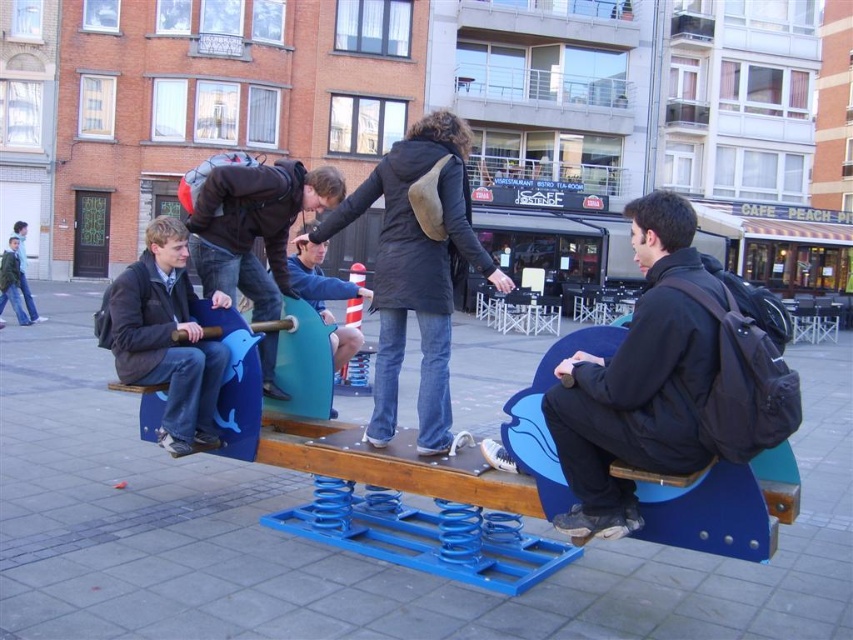
Who is taller, blue plastic bench at right or matte black jacket at left?

Standing taller between the two is matte black jacket at left.

Is blue plastic bench at right positioned before matte black jacket at left?

Yes, blue plastic bench at right is closer to the viewer.

Is point (695, 531) positioned before point (97, 314)?

Yes, it is.

You are a GUI agent. You are given a task and a screenshot of the screen. Output one action in this format:
    pyautogui.click(x=<x>, y=<y>)
    Task: Click on the blue plastic bench at right
    Image resolution: width=853 pixels, height=640 pixels.
    Given the screenshot: What is the action you would take?
    point(717,506)

Is blue painted wood park bench at center shorter than blue plastic bench at right?

Incorrect, blue painted wood park bench at center's height does not fall short of blue plastic bench at right's.

Is blue painted wood park bench at center in front of blue plastic bench at right?

No, it is not.

Who is more distant from viewer, (402, 516) or (666, 486)?

The point (402, 516) is behind.

At what (x,y) coordinates should I click in order to perform the action: click on blue painted wood park bench at center. Please return your answer as a coordinate pair (x, y). Looking at the image, I should click on (451, 499).

Can you confirm if blue painted wood park bench at center is taller than matte black jacket at left?

No.

Looking at this image, which is below, blue painted wood park bench at center or matte black jacket at left?

Positioned lower is blue painted wood park bench at center.

What do you see at coordinates (451, 499) in the screenshot? I see `blue painted wood park bench at center` at bounding box center [451, 499].

You are a GUI agent. You are given a task and a screenshot of the screen. Output one action in this format:
    pyautogui.click(x=<x>, y=<y>)
    Task: Click on the blue painted wood park bench at center
    Image resolution: width=853 pixels, height=640 pixels.
    Given the screenshot: What is the action you would take?
    pyautogui.click(x=451, y=499)